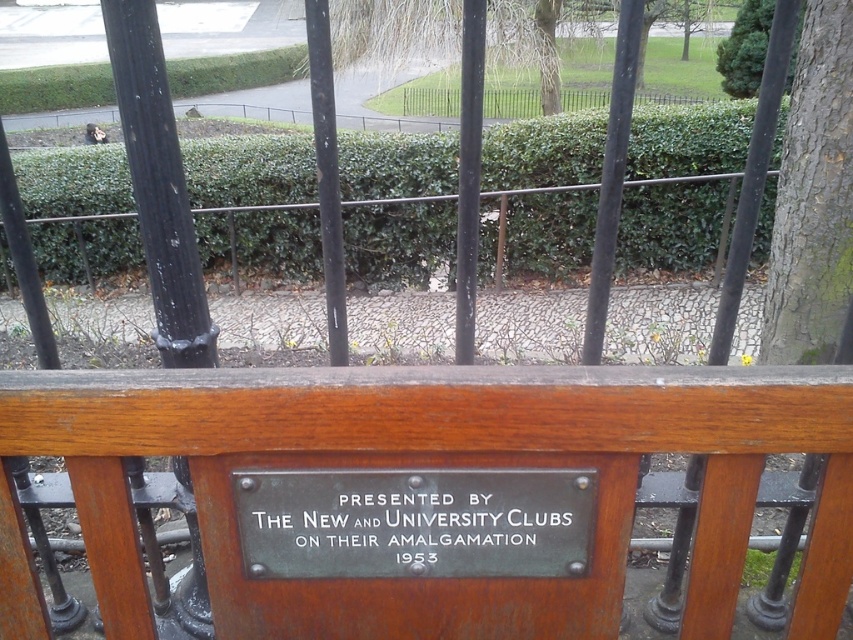
Question: Which of the following is the closest to the observer?

Choices:
 (A) green rough bark tree at right
 (B) green leafy hedge at center

Answer: (A)

Question: From the image, what is the correct spatial relationship of wooden bench at center in relation to green leafy tree at upper right?

Choices:
 (A) above
 (B) below

Answer: (B)

Question: Based on their relative distances, which object is nearer to the green leafy tree at upper right?

Choices:
 (A) wooden bench at center
 (B) green rough bark tree at right
 (C) green leafy hedge at center

Answer: (B)

Question: Considering the relative positions of wooden bench at center and green rough bark tree at right in the image provided, where is wooden bench at center located with respect to green rough bark tree at right?

Choices:
 (A) below
 (B) above

Answer: (A)

Question: Which of the following is the closest to the observer?

Choices:
 (A) green leafy hedge at center
 (B) green leafy tree at upper right

Answer: (B)

Question: Does wooden bench at center have a greater width compared to green patina plaque at center?

Choices:
 (A) yes
 (B) no

Answer: (A)